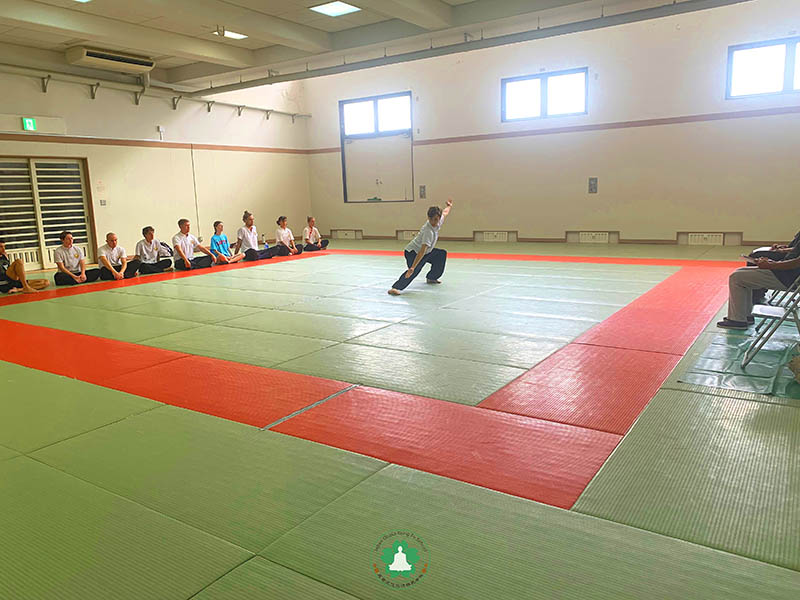
Identify the location of ceiling light. The width and height of the screenshot is (800, 600). (334, 13), (230, 32).